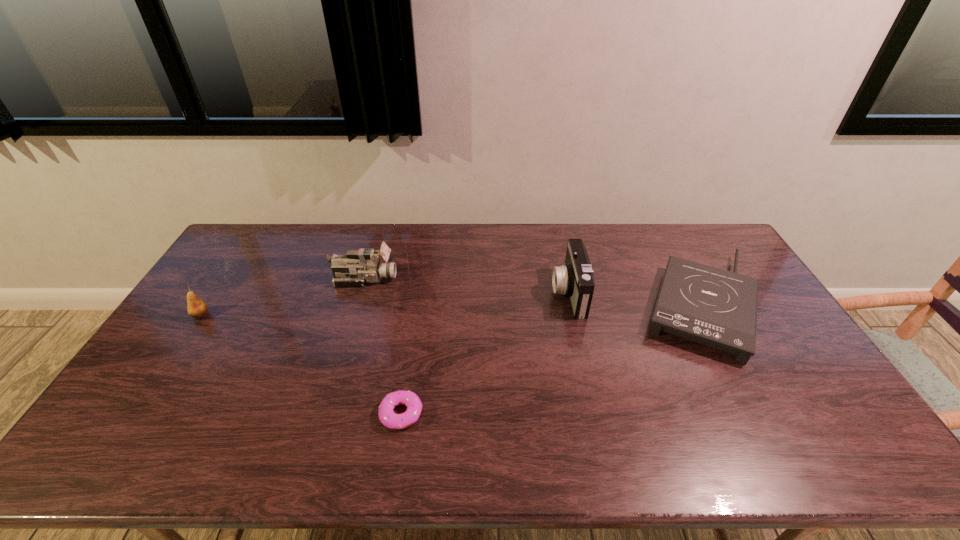
At what (x,y) coordinates should I click in order to perform the action: click on vacant space located 0.060m on the lens of the right camcorder. Please return your answer as a coordinate pair (x, y). This screenshot has height=540, width=960. Looking at the image, I should click on (535, 293).

Identify the location of vacant area situated 0.200m on the front-facing side of the left camcorder. (455, 279).

You are a GUI agent. You are given a task and a screenshot of the screen. Output one action in this format:
    pyautogui.click(x=<x>, y=<y>)
    Task: Click on the vacant space located on the back of the third tallest object
    
    Given the screenshot: What is the action you would take?
    pyautogui.click(x=244, y=250)

The height and width of the screenshot is (540, 960). In order to click on vacant space located on the back of the rightmost object in this screenshot , I will do `click(666, 238)`.

I want to click on free location located 0.380m on the back of the third object from right to left, so pos(419,297).

You are a GUI agent. You are given a task and a screenshot of the screen. Output one action in this format:
    pyautogui.click(x=<x>, y=<y>)
    Task: Click on the object located in the far edge section of the desktop
    
    Given the screenshot: What is the action you would take?
    pyautogui.click(x=717, y=308)

Identify the location of object that is at the left edge. (196, 308).

Find the location of a particular element. This screenshot has height=540, width=960. object located at the right edge is located at coordinates (717, 308).

You are a GUI agent. You are given a task and a screenshot of the screen. Output one action in this format:
    pyautogui.click(x=<x>, y=<y>)
    Task: Click on the object that is at the far right corner
    The height and width of the screenshot is (540, 960).
    Given the screenshot: What is the action you would take?
    pyautogui.click(x=717, y=308)

This screenshot has height=540, width=960. In the image, there is a desktop. In order to click on vacant region at the far edge in this screenshot , I will do `click(308, 254)`.